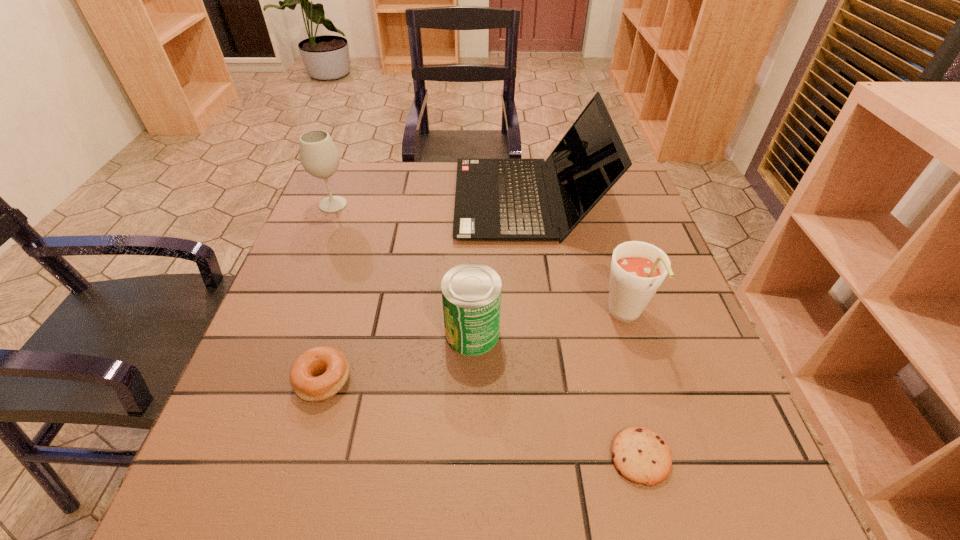
In the image, there is a desktop. In order to click on free space at the far left corner in this screenshot , I will do `click(367, 169)`.

The image size is (960, 540). In order to click on vacant space at the far right corner in this screenshot , I will do `click(615, 187)`.

At what (x,y) coordinates should I click in order to perform the action: click on blank region between the second nearest object and the nearest object. Please return your answer as a coordinate pair (x, y). This screenshot has height=540, width=960. Looking at the image, I should click on (482, 418).

Where is `free space between the cookie and the root beer`? This screenshot has height=540, width=960. free space between the cookie and the root beer is located at coordinates (633, 387).

At what (x,y) coordinates should I click in order to perform the action: click on free space between the nearest object and the laptop computer. Please return your answer as a coordinate pair (x, y). Looking at the image, I should click on (584, 328).

At what (x,y) coordinates should I click in order to perform the action: click on vacant area between the root beer and the can. Please return your answer as a coordinate pair (x, y). Looking at the image, I should click on (549, 325).

You are a GUI agent. You are given a task and a screenshot of the screen. Output one action in this format:
    pyautogui.click(x=<x>, y=<y>)
    Task: Click on the free space between the laptop computer and the fifth tallest object
    
    Given the screenshot: What is the action you would take?
    coord(425,290)

Locate an element on the screen. free spot between the laptop computer and the leftmost object is located at coordinates (430, 202).

Locate an element on the screen. Image resolution: width=960 pixels, height=540 pixels. free spot between the fifth farthest object and the laptop computer is located at coordinates (425, 290).

The image size is (960, 540). I want to click on free space between the can and the nearest object, so click(556, 395).